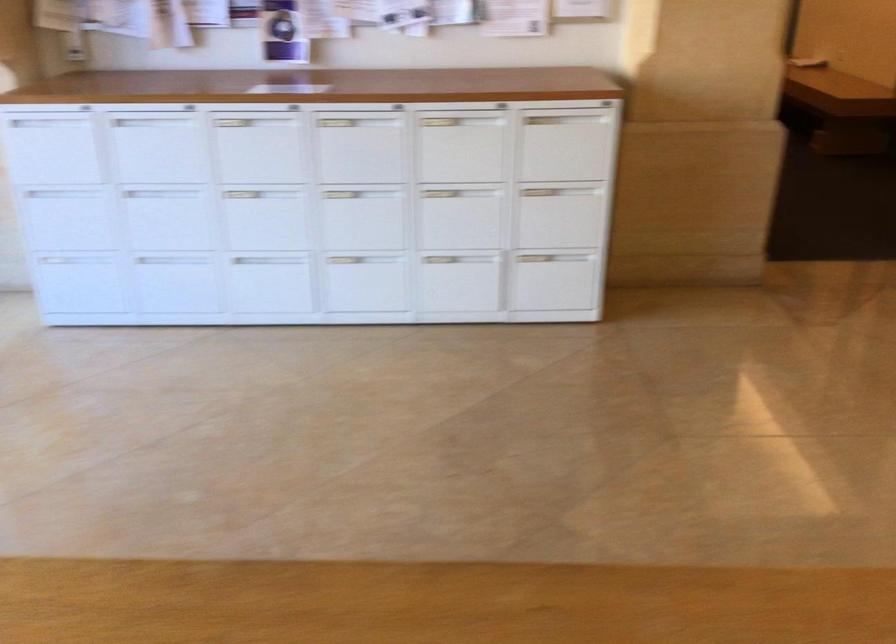
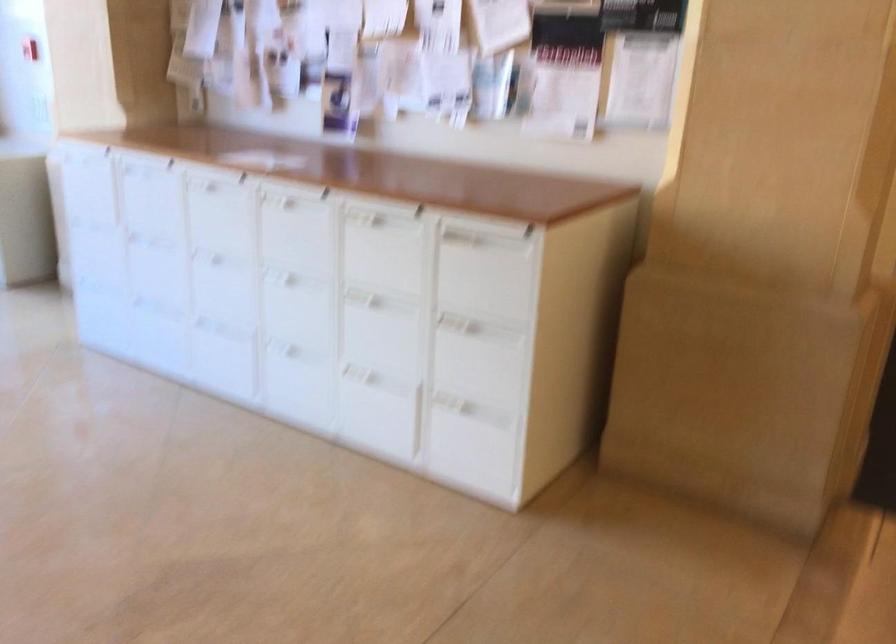
Where in the second image is the point corresponding to (459,140) from the first image?

(382, 247)